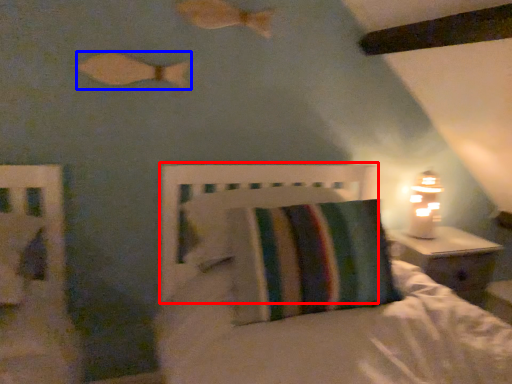
Question: Among these objects, which one is nearest to the camera, headboard (highlighted by a red box) or fish (highlighted by a blue box)?

Choices:
 (A) headboard
 (B) fish

Answer: (A)